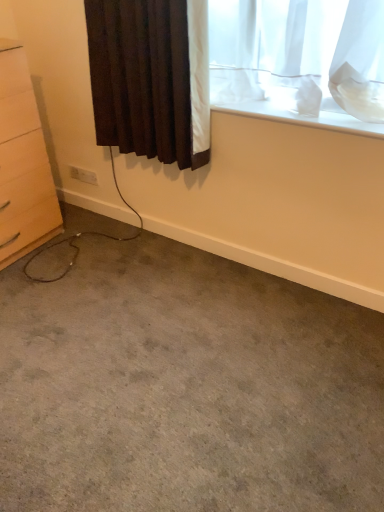
Question: Is white plastic electric outlet at lower left facing towards gray carpet at lower center?

Choices:
 (A) yes
 (B) no

Answer: (B)

Question: Is white plastic electric outlet at lower left touching gray carpet at lower center?

Choices:
 (A) no
 (B) yes

Answer: (A)

Question: Does white plastic electric outlet at lower left have a larger size compared to gray carpet at lower center?

Choices:
 (A) yes
 (B) no

Answer: (B)

Question: From the image's perspective, is white plastic electric outlet at lower left on gray carpet at lower center?

Choices:
 (A) no
 (B) yes

Answer: (B)

Question: Considering the relative sizes of white plastic electric outlet at lower left and gray carpet at lower center in the image provided, is white plastic electric outlet at lower left taller than gray carpet at lower center?

Choices:
 (A) yes
 (B) no

Answer: (A)

Question: Looking at their shapes, would you say gray carpet at lower center is wider or thinner than white matte window sill at upper right?

Choices:
 (A) wide
 (B) thin

Answer: (A)

Question: Based on their sizes in the image, would you say gray carpet at lower center is bigger or smaller than white matte window sill at upper right?

Choices:
 (A) small
 (B) big

Answer: (B)

Question: Choose the correct answer: Is gray carpet at lower center inside white matte window sill at upper right or outside it?

Choices:
 (A) outside
 (B) inside

Answer: (A)

Question: From their relative heights in the image, would you say gray carpet at lower center is taller or shorter than white matte window sill at upper right?

Choices:
 (A) short
 (B) tall

Answer: (B)

Question: From the image's perspective, is white matte window sill at upper right located above or below light wood chest of drawers at left?

Choices:
 (A) below
 (B) above

Answer: (B)

Question: Would you say white matte window sill at upper right is inside or outside light wood chest of drawers at left?

Choices:
 (A) inside
 (B) outside

Answer: (B)

Question: Is white matte window sill at upper right taller or shorter than light wood chest of drawers at left?

Choices:
 (A) tall
 (B) short

Answer: (B)

Question: Is white matte window sill at upper right wider or thinner than light wood chest of drawers at left?

Choices:
 (A) thin
 (B) wide

Answer: (A)

Question: Is point (46, 199) closer or farther from the camera than point (109, 33)?

Choices:
 (A) farther
 (B) closer

Answer: (A)

Question: In the image, is light wood chest of drawers at left positioned in front of or behind brown textured curtain at upper left?

Choices:
 (A) front
 (B) behind

Answer: (B)